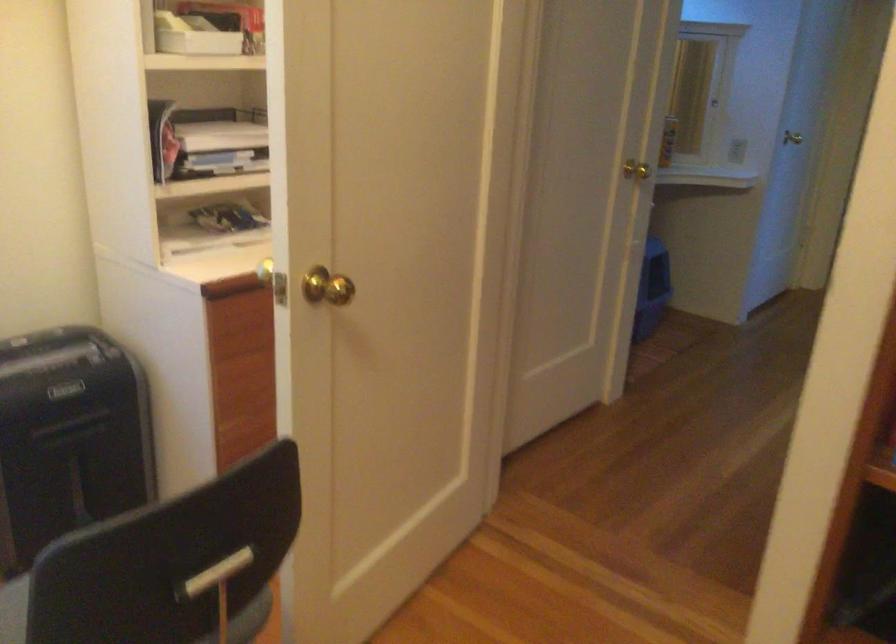
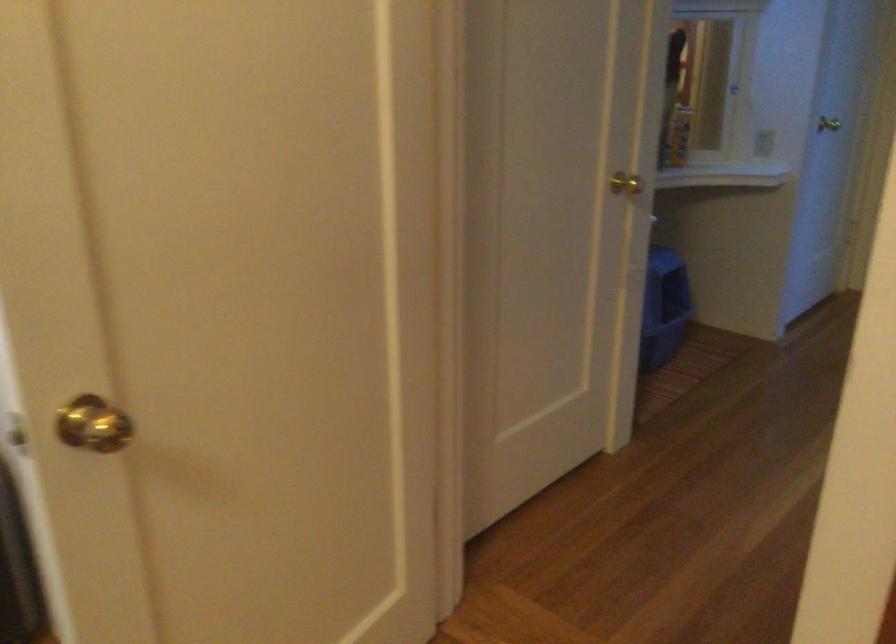
In the second image, find the point that corresponds to [633,169] in the first image.

(625, 184)